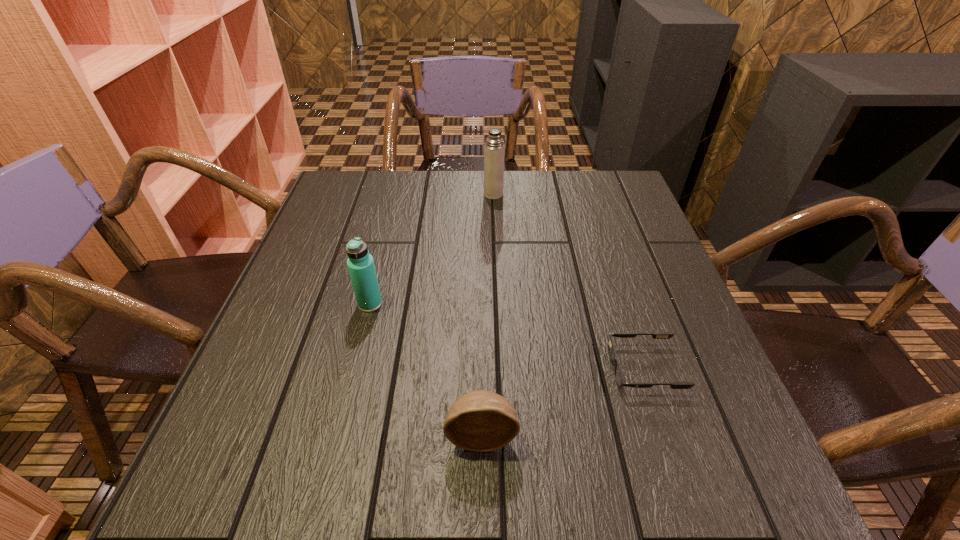
At what (x,y) coordinates should I click in order to perform the action: click on blank area located 0.280m on the right of the nearest object. Please return your answer as a coordinate pair (x, y). Looking at the image, I should click on (687, 435).

Image resolution: width=960 pixels, height=540 pixels. Find the location of `vacant space positioned on the temples of the shortest object`. vacant space positioned on the temples of the shortest object is located at coordinates (578, 368).

I want to click on free spot located 0.180m on the temples of the shortest object, so click(x=513, y=368).

Image resolution: width=960 pixels, height=540 pixels. Identify the location of vacant point located on the temples of the shortest object. (518, 368).

I want to click on object that is at the far edge, so click(494, 149).

Find the location of `object that is at the right edge`. object that is at the right edge is located at coordinates (619, 378).

At what (x,y) coordinates should I click in order to perform the action: click on vacant space at the far edge of the desktop. Please return your answer as a coordinate pair (x, y). Image resolution: width=960 pixels, height=540 pixels. Looking at the image, I should click on (456, 209).

The width and height of the screenshot is (960, 540). Find the location of `vacant region at the left edge`. vacant region at the left edge is located at coordinates (301, 354).

You are a GUI agent. You are given a task and a screenshot of the screen. Output one action in this format:
    pyautogui.click(x=<x>, y=<y>)
    Task: Click on the free space at the right edge of the desktop
    The height and width of the screenshot is (540, 960).
    Given the screenshot: What is the action you would take?
    pyautogui.click(x=694, y=433)

Identify the location of free space at the far left corner of the desktop. (343, 192).